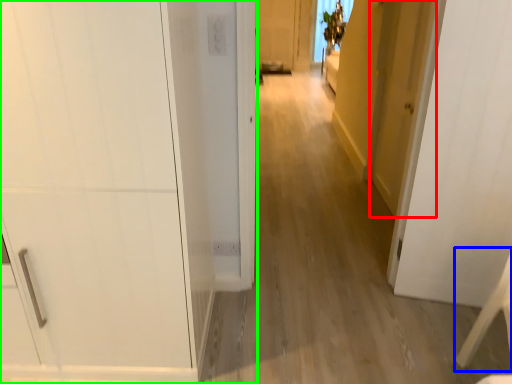
Question: Which is nearer to the door (highlighted by a red box)? furniture (highlighted by a blue box) or door (highlighted by a green box).

Choices:
 (A) furniture
 (B) door

Answer: (A)